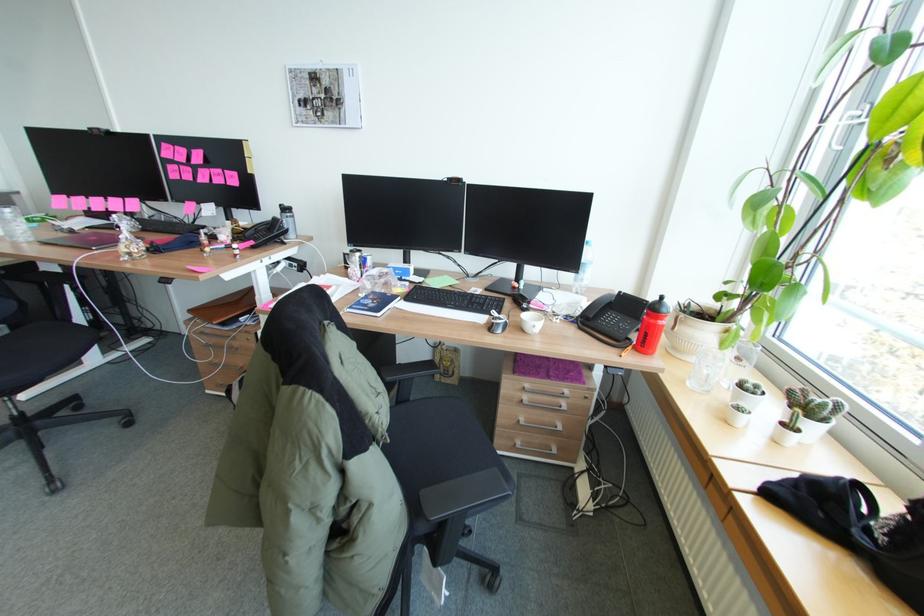
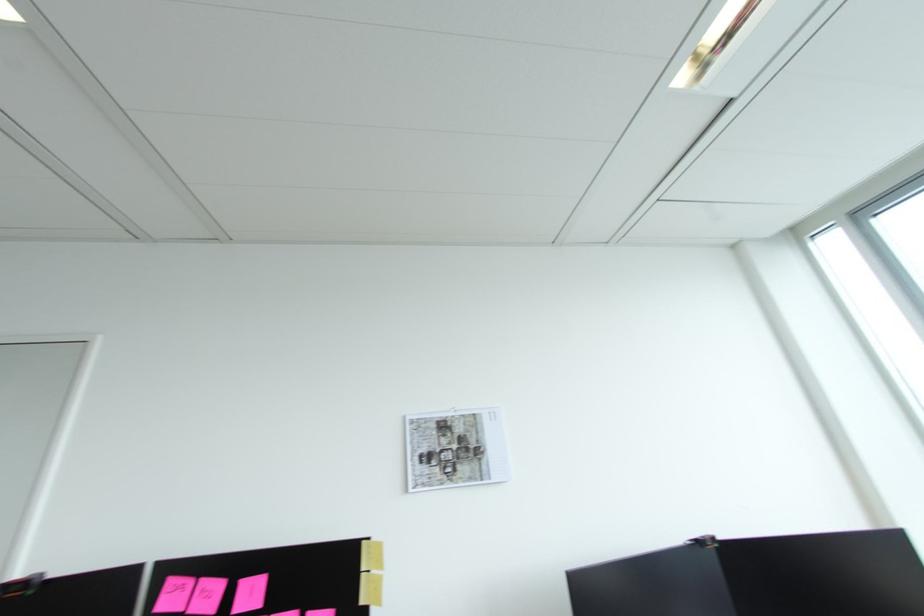
The point at (327, 97) is marked in the first image. Where is the corresponding point in the second image?

(459, 446)